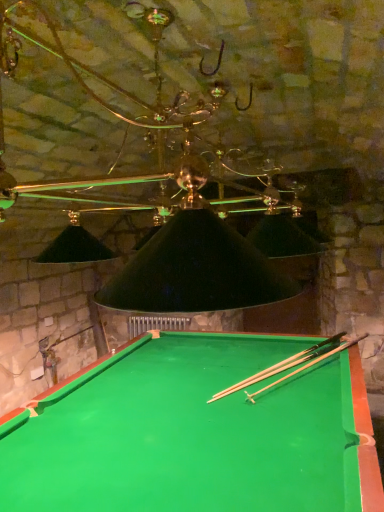
Question: From a real-world perspective, does green felt billiard table at center stand above wooden cue at center?

Choices:
 (A) no
 (B) yes

Answer: (A)

Question: Is green felt billiard table at center oriented away from wooden cue at center?

Choices:
 (A) no
 (B) yes

Answer: (A)

Question: From a real-world perspective, is green felt billiard table at center under wooden cue at center?

Choices:
 (A) no
 (B) yes

Answer: (B)

Question: Does green felt billiard table at center have a larger size compared to wooden cue at center?

Choices:
 (A) yes
 (B) no

Answer: (A)

Question: Can you confirm if green felt billiard table at center is thinner than wooden cue at center?

Choices:
 (A) no
 (B) yes

Answer: (A)

Question: Does green felt billiard table at center come in front of wooden cue at center?

Choices:
 (A) yes
 (B) no

Answer: (A)

Question: Considering the relative sizes of wooden cue at center and green felt billiard table at center in the image provided, is wooden cue at center taller than green felt billiard table at center?

Choices:
 (A) yes
 (B) no

Answer: (B)

Question: Is wooden cue at center next to green felt billiard table at center and touching it?

Choices:
 (A) yes
 (B) no

Answer: (B)

Question: Is wooden cue at center smaller than green felt billiard table at center?

Choices:
 (A) no
 (B) yes

Answer: (B)

Question: Could green felt billiard table at center be considered to be inside wooden cue at center?

Choices:
 (A) yes
 (B) no

Answer: (B)

Question: Does wooden cue at center lie in front of green felt billiard table at center?

Choices:
 (A) no
 (B) yes

Answer: (A)

Question: Can you confirm if wooden cue at center is positioned to the right of green felt billiard table at center?

Choices:
 (A) no
 (B) yes

Answer: (B)

Question: From a real-world perspective, is green felt billiard table at center above or below wooden cue at center?

Choices:
 (A) below
 (B) above

Answer: (A)